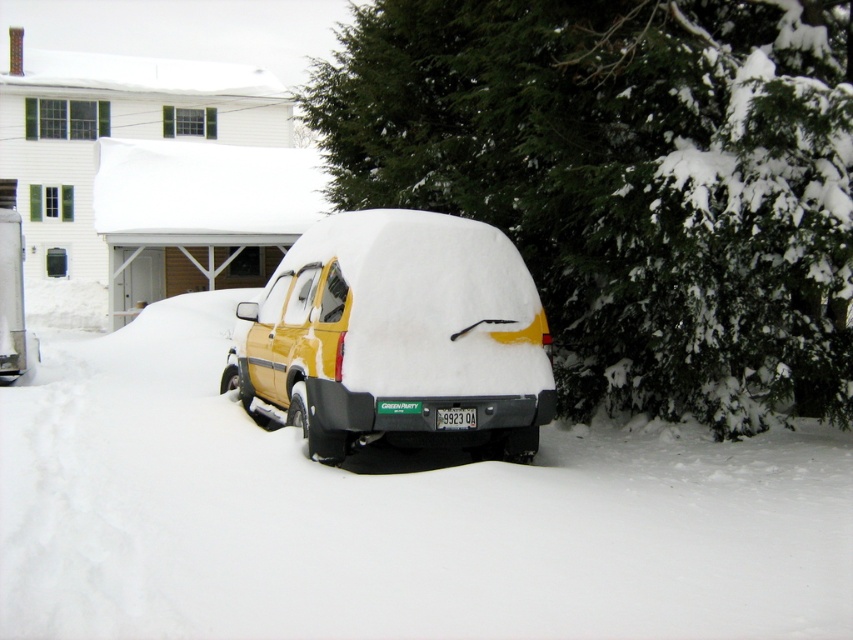
Question: Which point is closer to the camera?

Choices:
 (A) white fluffy snow at center
 (B) yellow matte van at center

Answer: (A)

Question: Where is white fluffy snow at center located in relation to yellow matte van at center in the image?

Choices:
 (A) above
 (B) below

Answer: (B)

Question: Does white fluffy snow at center have a greater width compared to yellow matte van at center?

Choices:
 (A) no
 (B) yes

Answer: (B)

Question: Is white fluffy snow at center above yellow matte van at center?

Choices:
 (A) no
 (B) yes

Answer: (A)